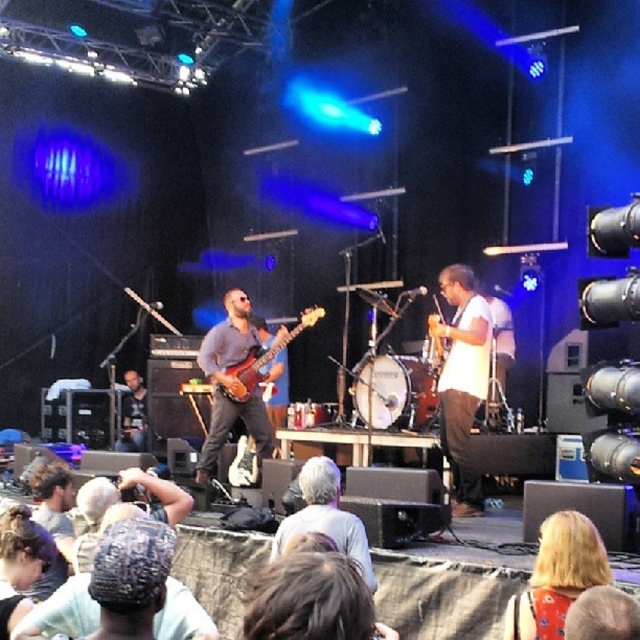
Is blonde hair at lower right positioned in front of matte brown guitar at center?

Yes, it is in front of matte brown guitar at center.

From the picture: Between blonde hair at lower right and matte brown guitar at center, which one has more height?

Standing taller between the two is matte brown guitar at center.

Is point (552, 564) closer to viewer compared to point (198, 362)?

Yes, it is.

Image resolution: width=640 pixels, height=640 pixels. Find the location of `blonde hair at lower right`. blonde hair at lower right is located at coordinates (557, 577).

Where is `matte brown guitar at center`? The height and width of the screenshot is (640, 640). matte brown guitar at center is located at coordinates (230, 384).

The height and width of the screenshot is (640, 640). I want to click on matte brown guitar at center, so click(230, 384).

Is blonde hair at lower right to the left of brown wood electric guitar at center from the viewer's perspective?

No, blonde hair at lower right is not to the left of brown wood electric guitar at center.

Does blonde hair at lower right have a lesser width compared to brown wood electric guitar at center?

Yes, blonde hair at lower right is thinner than brown wood electric guitar at center.

Between point (556, 612) and point (266, 376), which one is positioned behind?

Positioned behind is point (266, 376).

Identify the location of blonde hair at lower right. This screenshot has height=640, width=640. (557, 577).